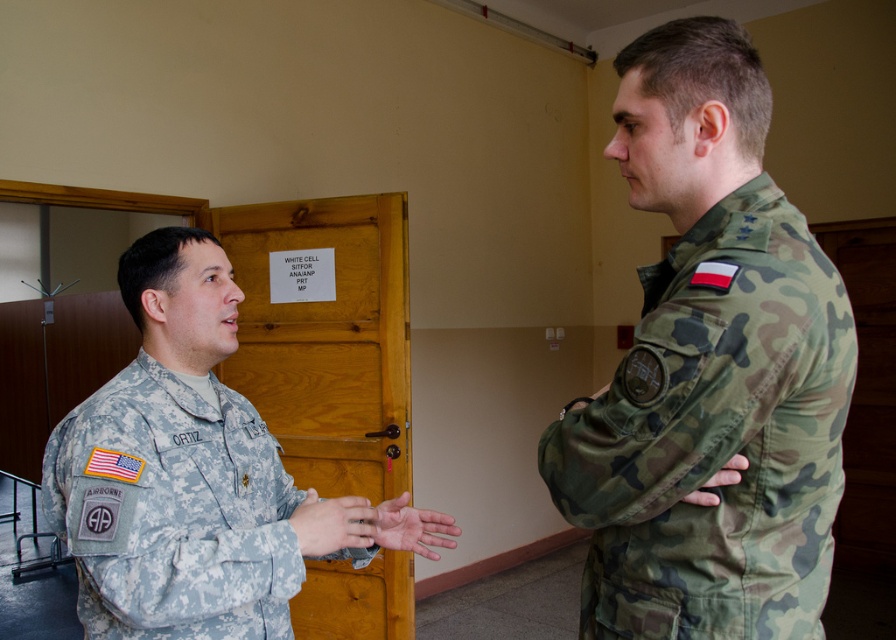
You are a tailor measuring two items in the image to create a custom accessory. You need to determine which item is larger in size. Which one is bigger between the camo fabric uniform at right and the smooth skin hand at center?

The camo fabric uniform at right is bigger than the smooth skin hand at center, so the camo fabric uniform at right is larger.

You are a military photographer positioned at the entrance of the room. You need to capture a portrait of the camo fabric uniform at right while ensuring the person on the left does not appear in the frame. Given your camera has a focal length of 50mm and a sensor size of 24mm x 36mm, what is the minimum distance you must move forward to exclude the person on the left from the frame?

The camo fabric uniform at right is 30.95 inches away from the viewer. To exclude the person on the left, you must position yourself closer than 30.95 inches to ensure only the camo fabric uniform at right is in the frame.

You are an observer in the room where the two military personnel are conversing. There is a point marked at coordinates (714, 436). Which object does this point correspond to?

The point at coordinates (714, 436) corresponds to the camo fabric uniform at right.